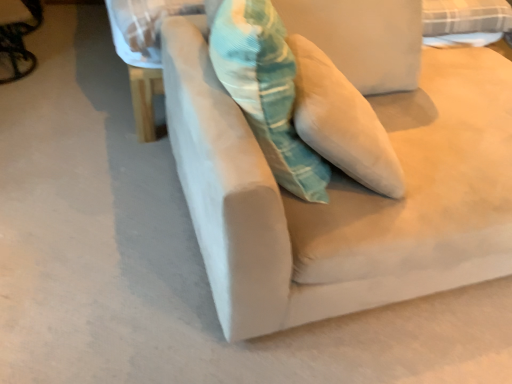
Question: Is textured teal pillow at center far away from metallic silver swivel chair at left?

Choices:
 (A) yes
 (B) no

Answer: (A)

Question: Is textured teal pillow at center thinner than metallic silver swivel chair at left?

Choices:
 (A) no
 (B) yes

Answer: (B)

Question: Is textured teal pillow at center taller than metallic silver swivel chair at left?

Choices:
 (A) no
 (B) yes

Answer: (B)

Question: Could you tell me if textured teal pillow at center is facing metallic silver swivel chair at left?

Choices:
 (A) no
 (B) yes

Answer: (A)

Question: From the image's perspective, is textured teal pillow at center over metallic silver swivel chair at left?

Choices:
 (A) no
 (B) yes

Answer: (A)

Question: Is textured teal pillow at center inside the boundaries of suede beige couch at center, or outside?

Choices:
 (A) outside
 (B) inside

Answer: (B)

Question: Is textured teal pillow at center bigger or smaller than suede beige couch at center?

Choices:
 (A) big
 (B) small

Answer: (B)

Question: From their relative heights in the image, would you say textured teal pillow at center is taller or shorter than suede beige couch at center?

Choices:
 (A) tall
 (B) short

Answer: (B)

Question: In the image, is textured teal pillow at center positioned in front of or behind suede beige couch at center?

Choices:
 (A) front
 (B) behind

Answer: (B)

Question: Considering the relative positions of suede beige couch at center and metallic silver swivel chair at left in the image provided, is suede beige couch at center to the left or to the right of metallic silver swivel chair at left?

Choices:
 (A) right
 (B) left

Answer: (A)

Question: In terms of width, does suede beige couch at center look wider or thinner when compared to metallic silver swivel chair at left?

Choices:
 (A) thin
 (B) wide

Answer: (B)

Question: Relative to metallic silver swivel chair at left, is suede beige couch at center in front or behind?

Choices:
 (A) behind
 (B) front

Answer: (B)

Question: Considering the positions of suede beige couch at center and metallic silver swivel chair at left in the image, is suede beige couch at center bigger or smaller than metallic silver swivel chair at left?

Choices:
 (A) big
 (B) small

Answer: (A)

Question: From the image's perspective, is suede beige couch at center located above or below textured teal pillow at center?

Choices:
 (A) above
 (B) below

Answer: (B)

Question: From a real-world perspective, is suede beige couch at center positioned above or below textured teal pillow at center?

Choices:
 (A) above
 (B) below

Answer: (B)